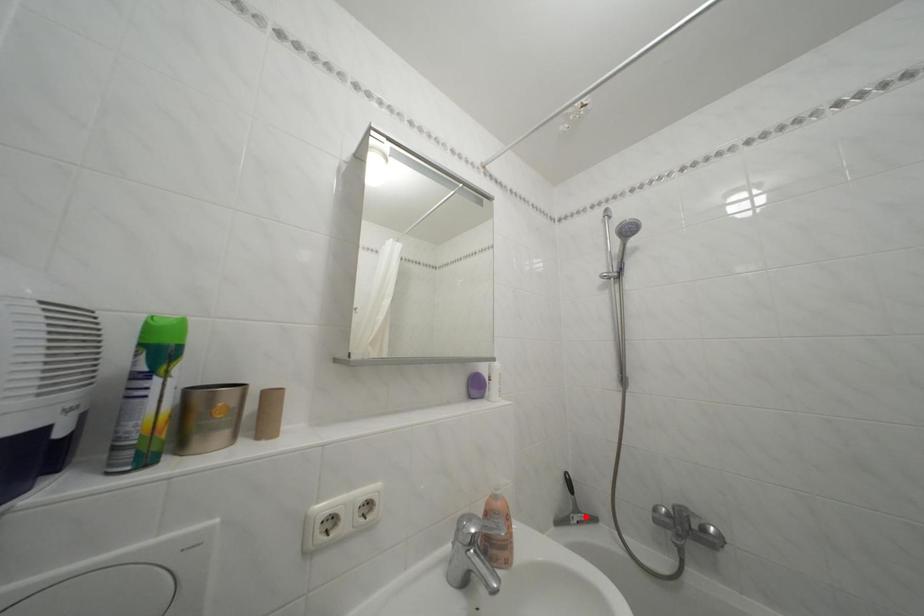
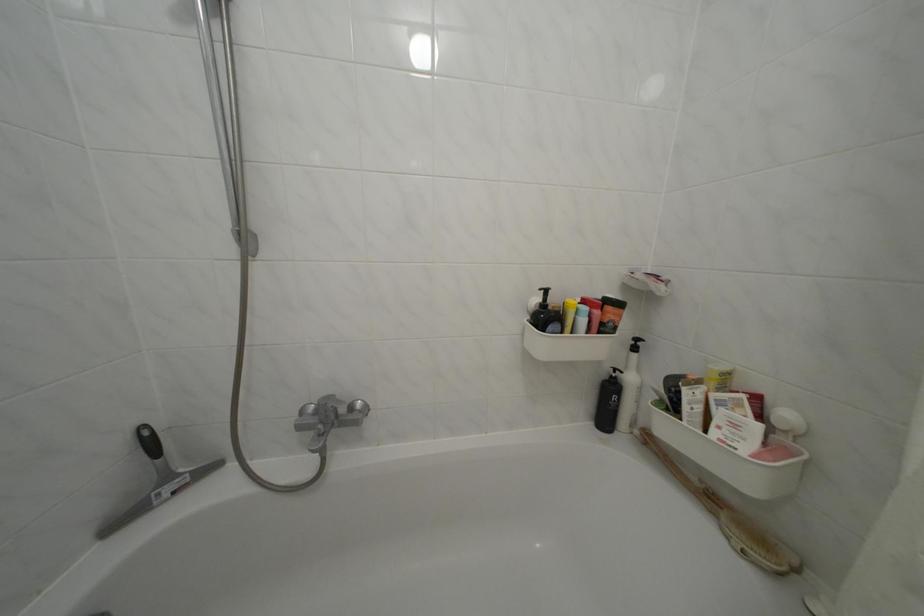
Question: I am providing you with two images of the same scene from different viewpoints. A red point is shown in image1. For the corresponding object point in image2, is it positioned nearer or farther from the camera?

Choices:
 (A) Nearer
 (B) Farther

Answer: (A)